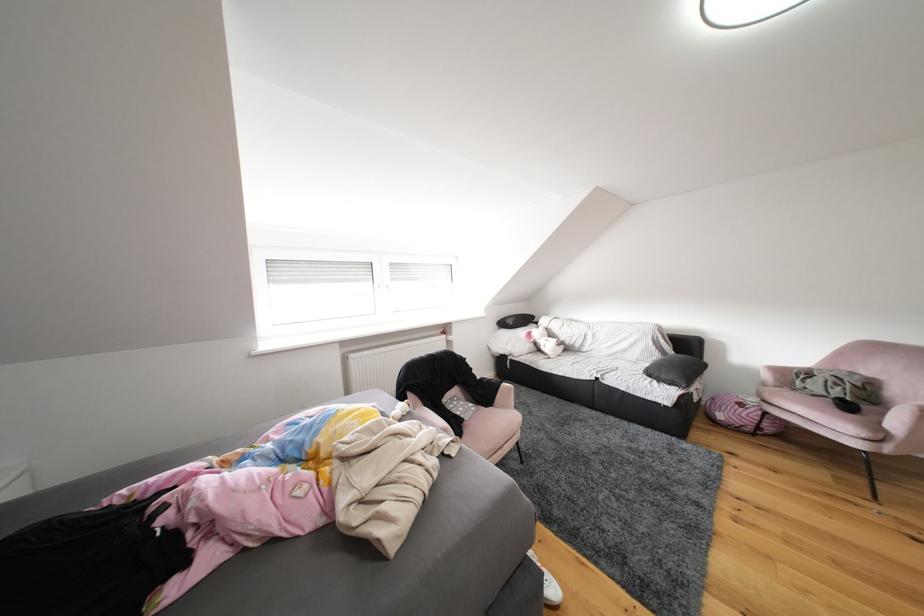
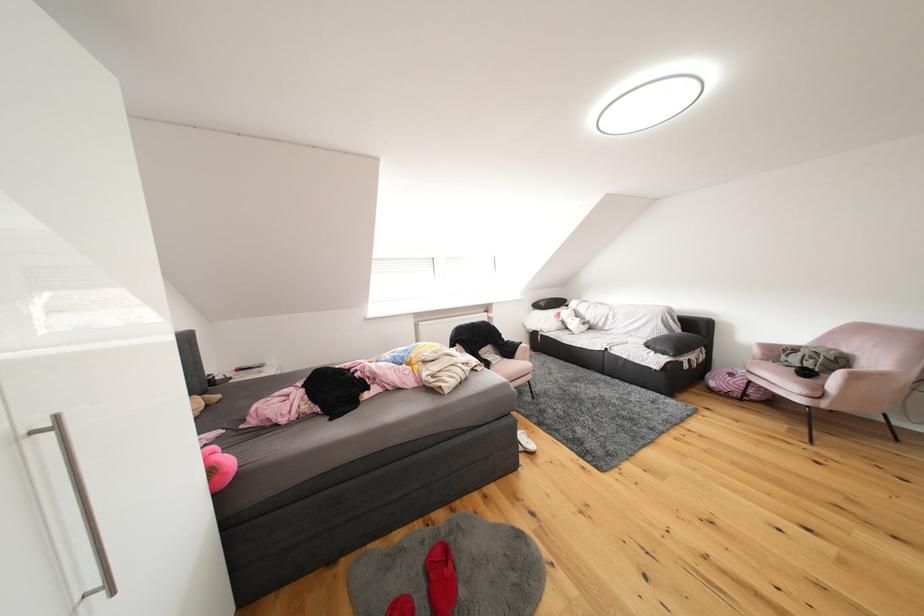
Locate, in the second image, the point that corresponds to (749,408) in the first image.

(740, 379)